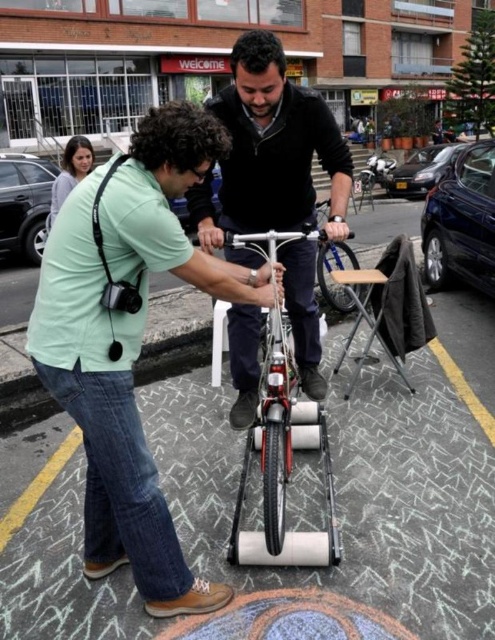
Question: In this image, where is shiny metallic bicycle at center located relative to shiny blue bicycle at center?

Choices:
 (A) left
 (B) right

Answer: (A)

Question: Which point is closer to the camera?

Choices:
 (A) (341, 244)
 (B) (274, 195)
 (C) (62, 209)

Answer: (C)

Question: Observing the image, what is the correct spatial positioning of shiny blue bicycle at center in reference to matte gray sweater at upper left?

Choices:
 (A) above
 (B) below

Answer: (B)

Question: Which point is closer to the camera?

Choices:
 (A) (324, 262)
 (B) (242, 77)
 (C) (82, 173)
 (D) (467, 461)

Answer: (B)

Question: Is green matte shirt at center below dark gray sweater at center?

Choices:
 (A) no
 (B) yes

Answer: (B)

Question: Which object is the farthest from the green matte shirt at center?

Choices:
 (A) matte gray sweater at upper left
 (B) shiny blue bicycle at center
 (C) dark gray sweater at center

Answer: (A)